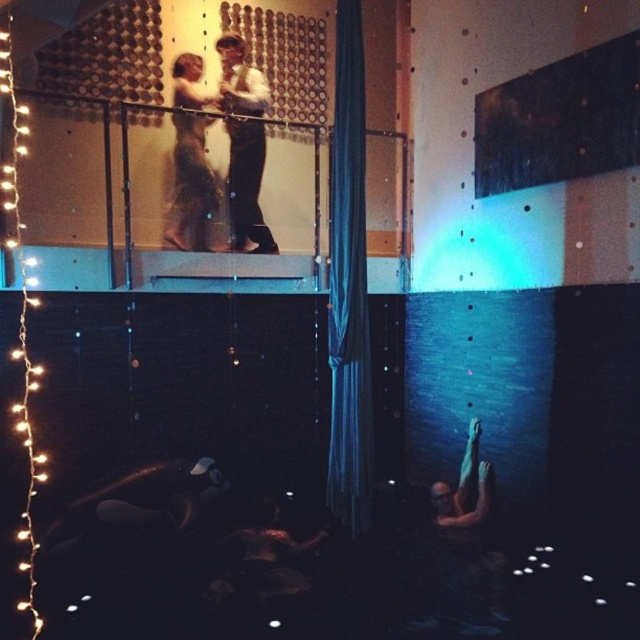
Question: Considering the real-world distances, which object is closest to the white shirt at upper center?

Choices:
 (A) satin white dress at upper center
 (B) blue silky curtain at center
 (C) smooth skin man at lower right

Answer: (A)

Question: Is blue silky curtain at center wider than smooth skin man at lower right?

Choices:
 (A) yes
 (B) no

Answer: (B)

Question: Is white shirt at upper center to the right of satin white dress at upper center from the viewer's perspective?

Choices:
 (A) no
 (B) yes

Answer: (B)

Question: Is blue silky curtain at center above satin white dress at upper center?

Choices:
 (A) yes
 (B) no

Answer: (B)

Question: Which point is farther to the camera?

Choices:
 (A) blue silky curtain at center
 (B) smooth skin man at lower right

Answer: (B)

Question: Which of the following is the farthest from the observer?

Choices:
 (A) white shirt at upper center
 (B) blue silky curtain at center

Answer: (A)